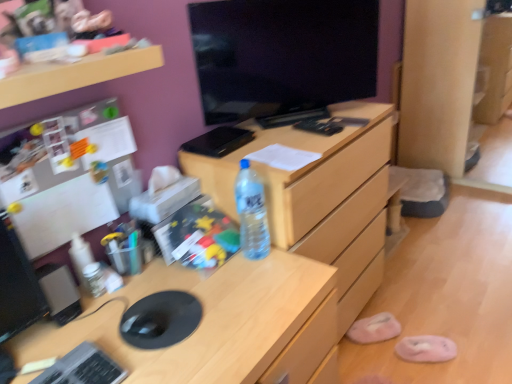
Question: From a real-world perspective, relative to wooden shelf at upper left, is pink fabric slipper at lower right, which appears as the 1th slipper when viewed from the back, vertically above or below?

Choices:
 (A) below
 (B) above

Answer: (A)

Question: Considering the positions of pink fabric slipper at lower right, which appears as the 1th slipper when viewed from the back, and wooden shelf at upper left in the image, is pink fabric slipper at lower right, which appears as the 1th slipper when viewed from the back, wider or thinner than wooden shelf at upper left?

Choices:
 (A) thin
 (B) wide

Answer: (B)

Question: Estimate the real-world distances between objects in this image. Which object is farther from the black glossy monitor at center?

Choices:
 (A) wooden shelf at upper left
 (B) pink fuzzy slipper at lower right, marked as the 1th slipper in a front-to-back arrangement
 (C) clear wood file cabinet at center
 (D) translucent plastic water bottle at center
 (E) pink fabric slipper at lower right, which is counted as the 2th slipper, starting from the right

Answer: (B)

Question: Which object is positioned closest to the silver metallic keyboard at lower left?

Choices:
 (A) black glossy monitor at center
 (B) pink fuzzy slipper at lower right, marked as the second slipper in a back-to-front arrangement
 (C) translucent plastic water bottle at center
 (D) pink fabric slipper at lower right, which is counted as the 2th slipper, starting from the right
 (E) wooden shelf at upper left

Answer: (C)